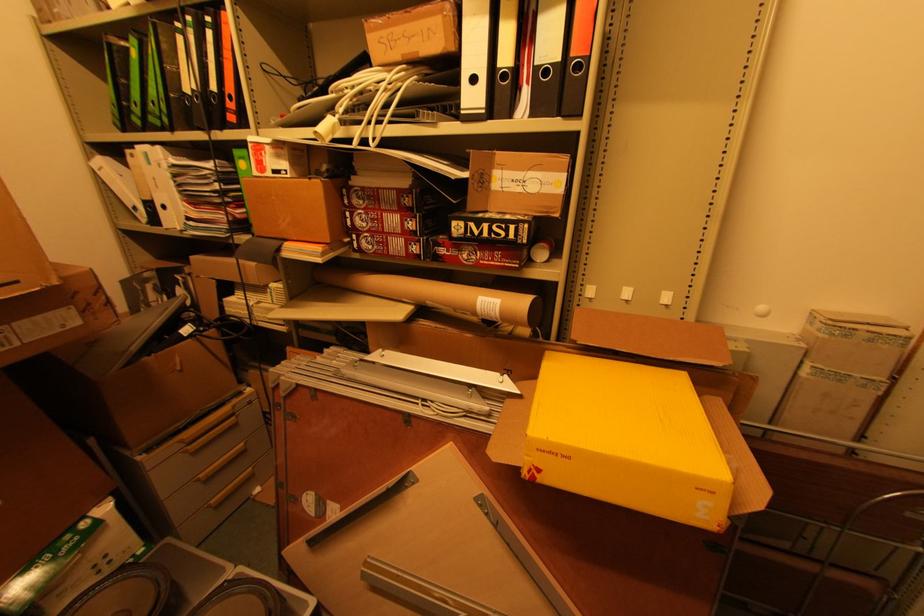
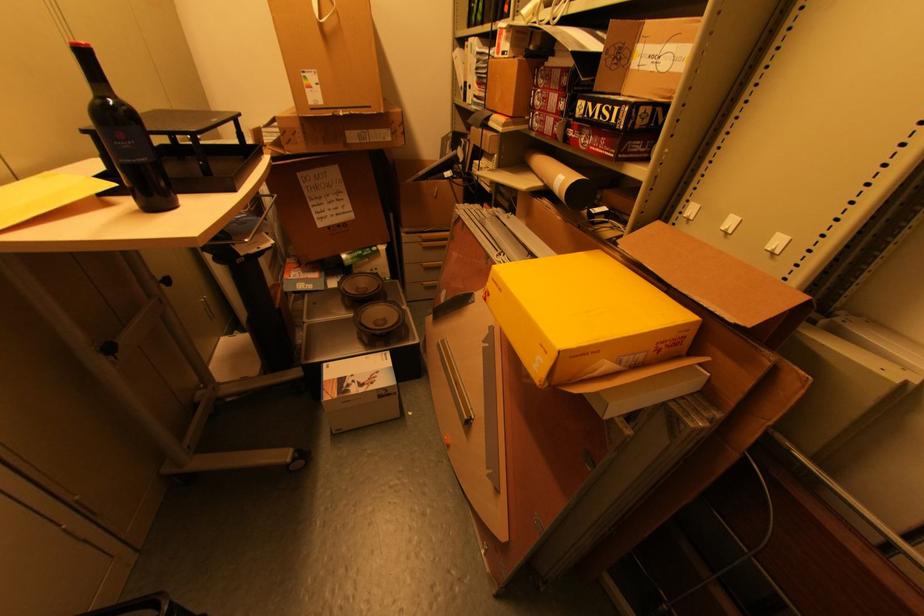
Where in the second image is the point corresponding to [554,453] from the first image?

(499, 284)